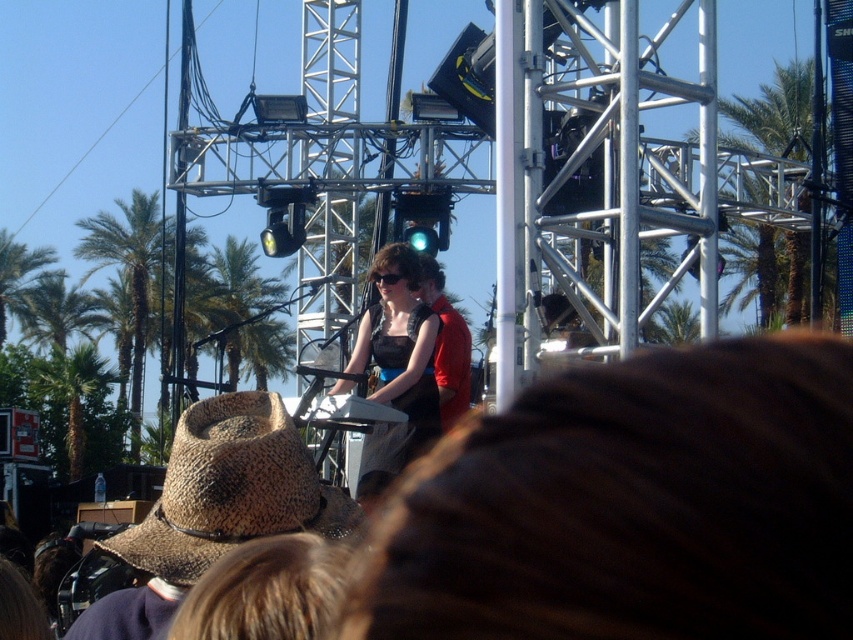
Can you confirm if brown woven cowboy hat at lower left is smaller than green leafy palm tree at left?

Indeed, brown woven cowboy hat at lower left has a smaller size compared to green leafy palm tree at left.

Does brown woven cowboy hat at lower left have a lesser width compared to green leafy palm tree at left?

Yes, brown woven cowboy hat at lower left is thinner than green leafy palm tree at left.

Which is behind, point (229, 476) or point (142, 316)?

The point (142, 316) is more distant.

In order to click on brown woven cowboy hat at lower left in this screenshot , I will do `click(231, 490)`.

Which is below, green leafy palm tree at center or green leafy palm tree at left?

green leafy palm tree at center

Locate an element on the screen. green leafy palm tree at center is located at coordinates pyautogui.click(x=247, y=314).

Is brown woven cowboy hat at lower left positioned at the back of green leafy palm tree at center?

No.

Does brown woven cowboy hat at lower left have a greater width compared to green leafy palm tree at center?

No.

What are the coordinates of `brown woven cowboy hat at lower left` in the screenshot? It's located at (231, 490).

Identify the location of brown woven cowboy hat at lower left. This screenshot has height=640, width=853. (231, 490).